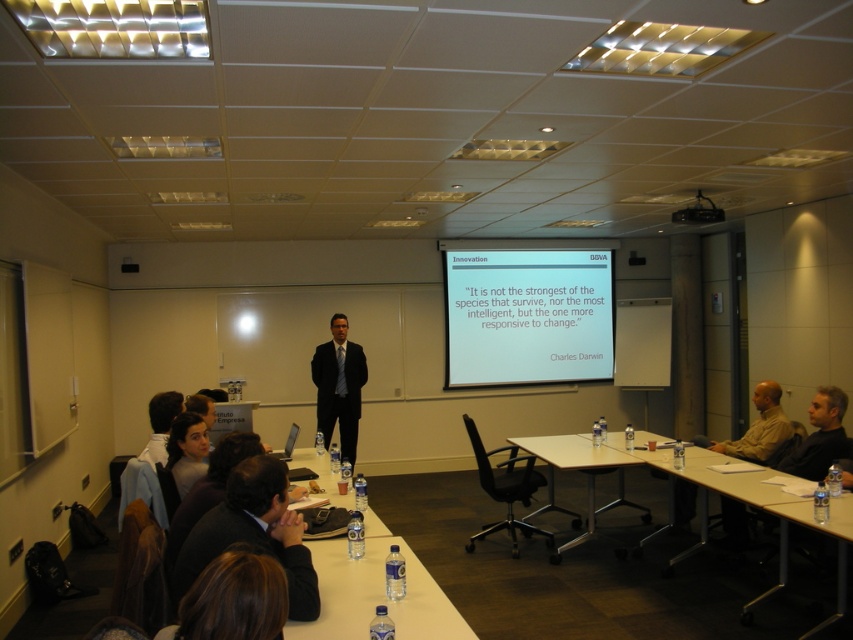
You are attending a presentation in the conference room and want to locate the white matte projector screen at upper center. Based on the coordinates provided, can you confirm if the point at (527, 316) is where the screen is located?

Yes, the point at (527, 316) corresponds to the white matte projector screen at upper center as stated in the description.